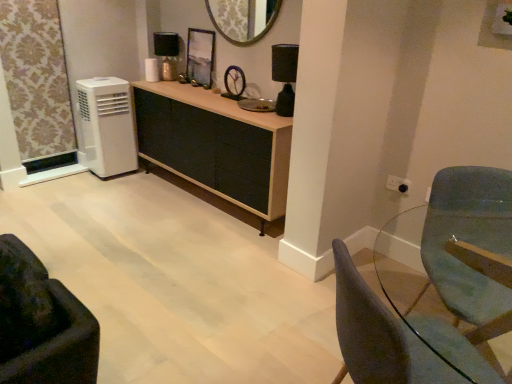
Question: Considering the positions of point pos(205,82) and point pos(278,49), is point pos(205,82) closer or farther from the camera than point pos(278,49)?

Choices:
 (A) farther
 (B) closer

Answer: (A)

Question: From the image's perspective, is metallic reflective frame at center located above or below black matte lamp at upper right, which appears as the first lamp when viewed from the front?

Choices:
 (A) above
 (B) below

Answer: (A)

Question: Considering the real-world distances, which object is closest to the metallic gold lamp at upper center, the first lamp from the back?

Choices:
 (A) metallic reflective frame at center
 (B) wooden cabinet at center
 (C) teal fabric swivel chair at right
 (D) matte gray chair at lower right, placed as the second chair when sorted from left to right
 (E) gold textured mirror at upper center

Answer: (A)

Question: Estimate the real-world distances between objects in this image. Which object is farther from the metallic gold lamp at upper center, the 1th lamp when ordered from top to bottom?

Choices:
 (A) matte gray chair at lower right, the first chair when ordered from right to left
 (B) metallic reflective frame at center
 (C) wooden cabinet at center
 (D) gold textured mirror at upper center
 (E) velvet dark brown armchair at lower left, the 1th chair in the left-to-right sequence

Answer: (A)